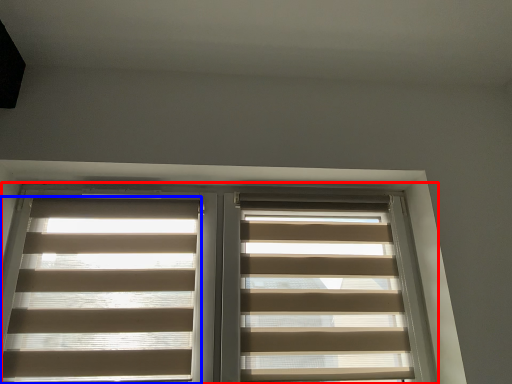
Question: Which object is further to the camera taking this photo, window (highlighted by a red box) or window blind (highlighted by a blue box)?

Choices:
 (A) window
 (B) window blind

Answer: (B)